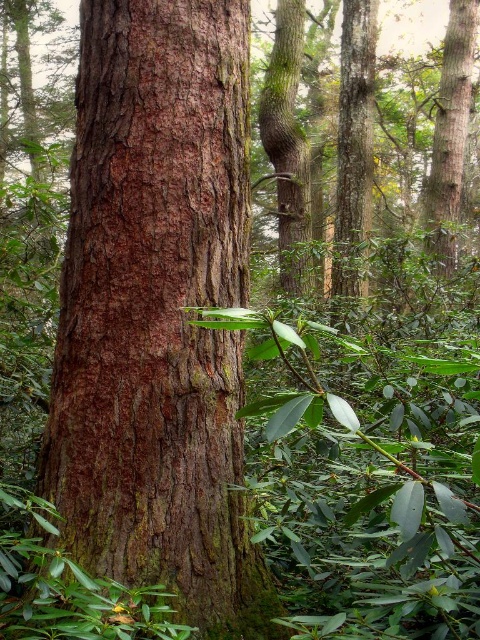
Which of these two, brown rough bark tree trunk at left or smooth brown tree trunk at upper right, stands shorter?

With less height is brown rough bark tree trunk at left.

Who is positioned more to the right, brown rough bark tree trunk at left or smooth brown tree trunk at upper right?

smooth brown tree trunk at upper right

Consider the image. Measure the distance between brown rough bark tree trunk at left and camera.

brown rough bark tree trunk at left and camera are 1.55 meters apart from each other.

At what (x,y) coordinates should I click in order to perform the action: click on brown rough bark tree trunk at left. Please return your answer as a coordinate pair (x, y). The image size is (480, 640). Looking at the image, I should click on (157, 312).